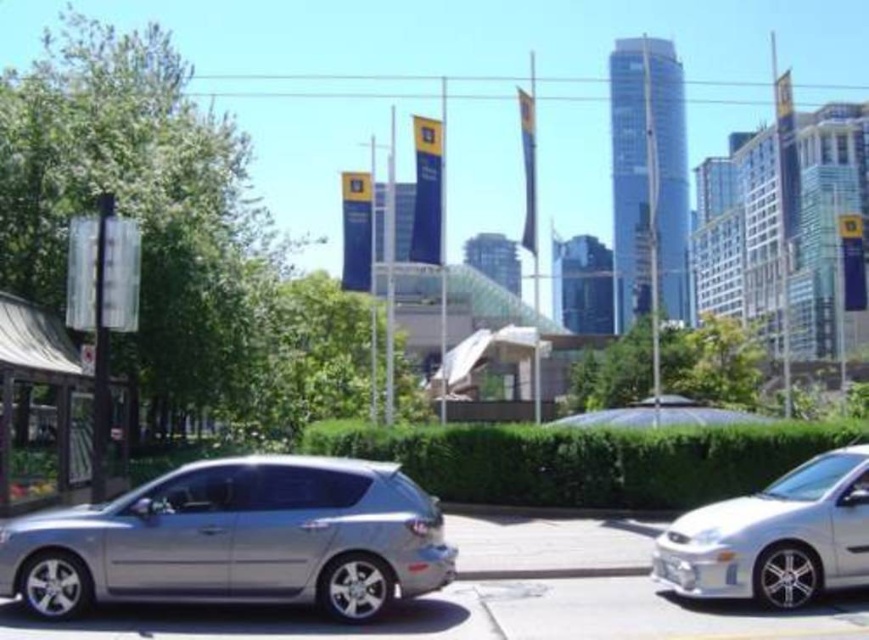
Is satin silver hatchback at center taller than satin white sedan at right?

In fact, satin silver hatchback at center may be shorter than satin white sedan at right.

Can you confirm if satin silver hatchback at center is smaller than satin white sedan at right?

Correct, satin silver hatchback at center occupies less space than satin white sedan at right.

Between point (10, 573) and point (737, 572), which one is positioned in front?

Point (10, 573)

Find the location of a particular element. The width and height of the screenshot is (869, 640). satin silver hatchback at center is located at coordinates (237, 540).

Between green leafy hedge at center and satin white sedan at right, which one has less height?

satin white sedan at right is shorter.

Who is higher up, green leafy hedge at center or satin white sedan at right?

Positioned higher is satin white sedan at right.

This screenshot has width=869, height=640. In order to click on green leafy hedge at center in this screenshot , I will do tap(586, 460).

Is point (28, 593) farther from viewer compared to point (867, 433)?

No, it is in front of (867, 433).

Does point (310, 532) lie in front of point (375, 451)?

Yes, point (310, 532) is in front of point (375, 451).

You are a GUI agent. You are given a task and a screenshot of the screen. Output one action in this format:
    pyautogui.click(x=<x>, y=<y>)
    Task: Click on the satin silver hatchback at center
    The width and height of the screenshot is (869, 640).
    Given the screenshot: What is the action you would take?
    pos(237,540)